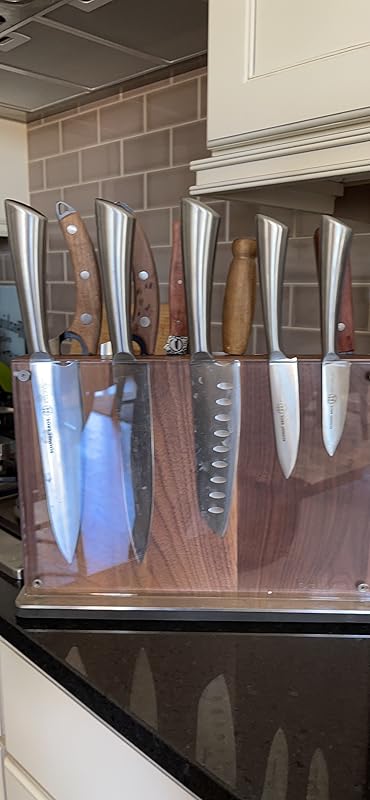
In order to click on reflection on table in this screenshot , I will do `click(276, 700)`.